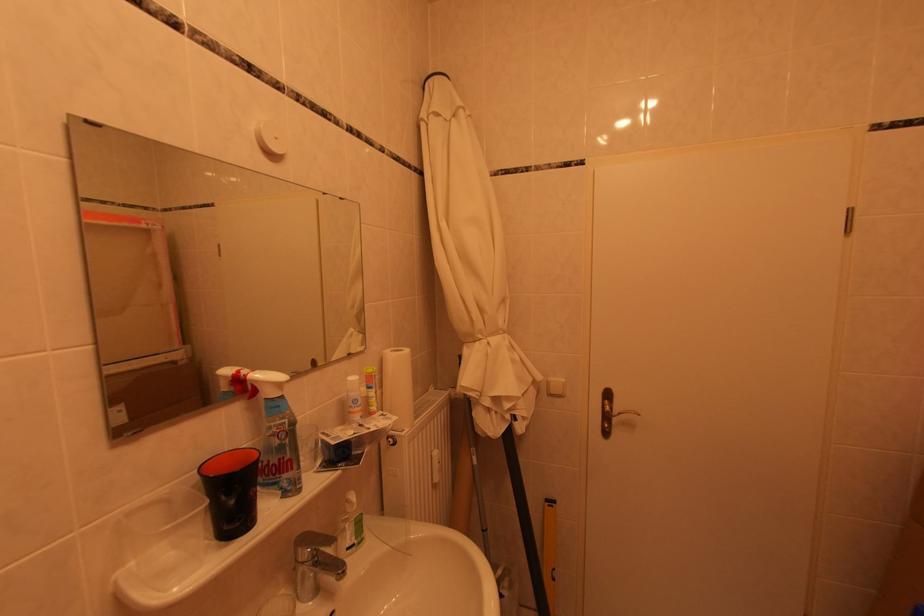
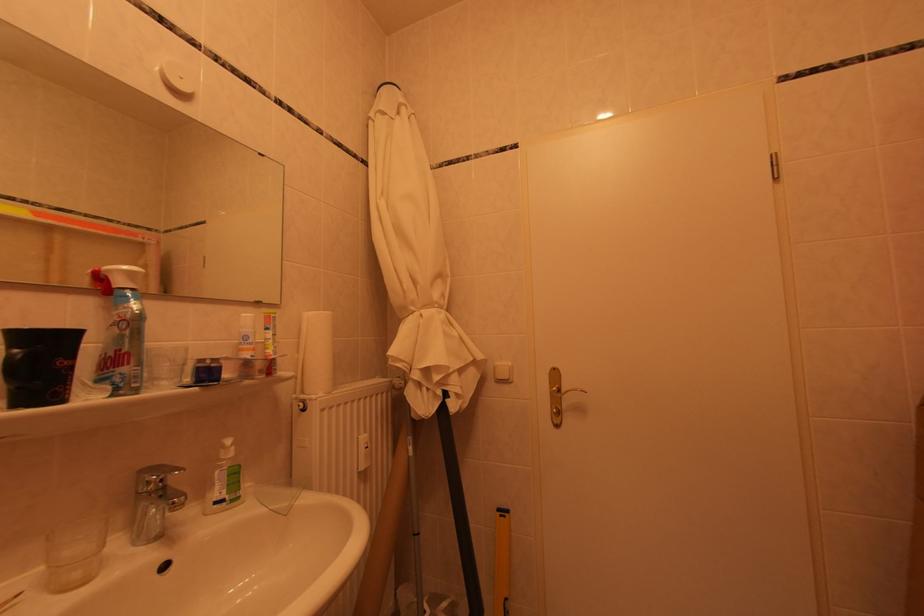
Where in the second image is the point corresponding to (x=560, y=383) from the first image?

(506, 367)